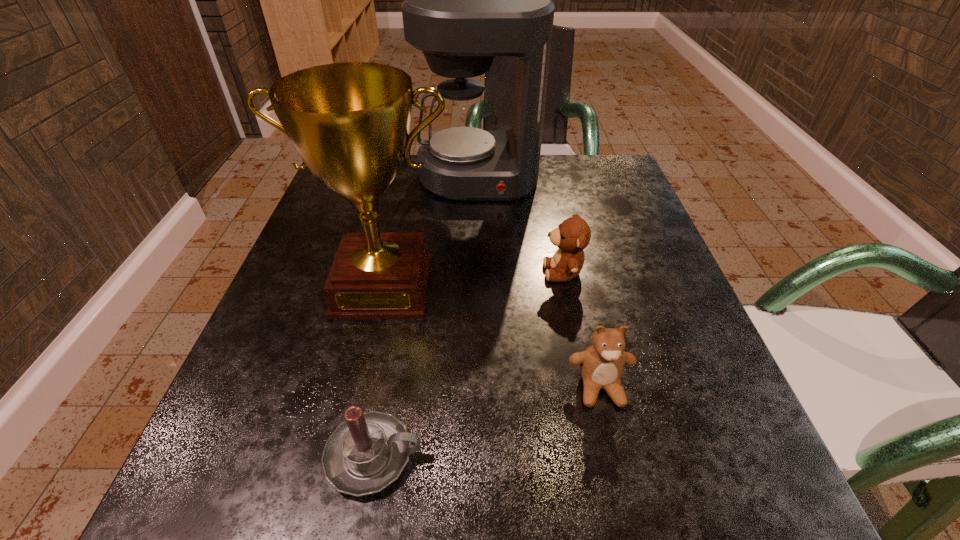
This screenshot has width=960, height=540. What are the coordinates of `free space at the far right corner of the desktop` in the screenshot? It's located at (627, 180).

Image resolution: width=960 pixels, height=540 pixels. In the image, there is a desktop. Identify the location of vacant area at the near right corner. (754, 511).

Identify the location of free area in between the farther teddy bear and the candle. This screenshot has height=540, width=960. (468, 364).

You are a GUI agent. You are given a task and a screenshot of the screen. Output one action in this format:
    pyautogui.click(x=<x>, y=<y>)
    Task: Click on the vacant space in between the farther teddy bear and the farthest object
    This screenshot has width=960, height=540.
    Given the screenshot: What is the action you would take?
    pyautogui.click(x=520, y=225)

The width and height of the screenshot is (960, 540). I want to click on vacant space that's between the award and the farthest object, so click(x=430, y=232).

Identify the location of vacant area that lies between the award and the candle. (378, 371).

The image size is (960, 540). Identify the location of vacant region between the second nearest object and the candle. (487, 422).

Where is `vacant region between the farther teddy bear and the nearest object`? vacant region between the farther teddy bear and the nearest object is located at coordinates (468, 364).

Where is `vacant area that lies between the farther teddy bear and the award`? This screenshot has width=960, height=540. vacant area that lies between the farther teddy bear and the award is located at coordinates (473, 279).

Where is `free space between the nearer teddy bear and the award`? free space between the nearer teddy bear and the award is located at coordinates (x=492, y=337).